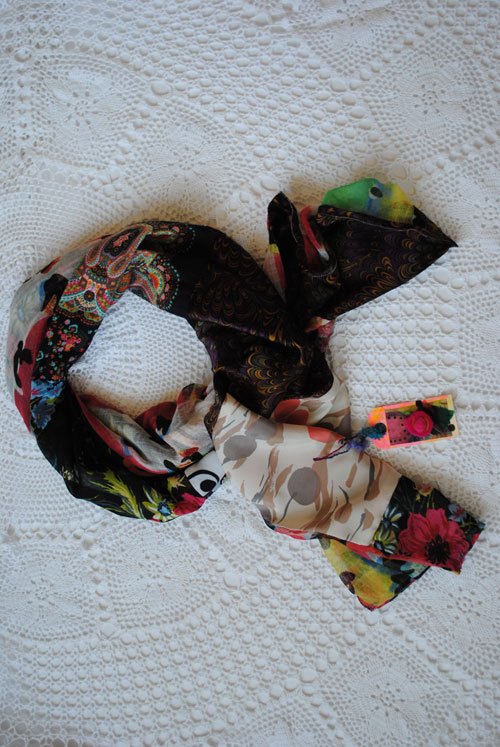
Locate an element on the screen. Image resolution: width=500 pixels, height=747 pixels. table cloth is located at coordinates (328, 688).